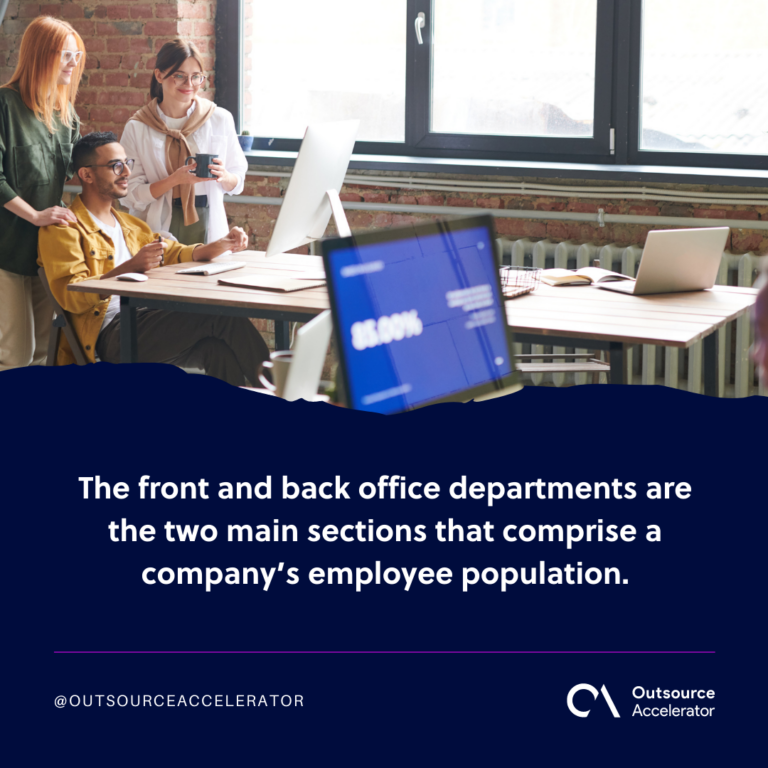
Locate an element on the screen. This screenshot has height=768, width=768. red brick wall is located at coordinates (117, 28).